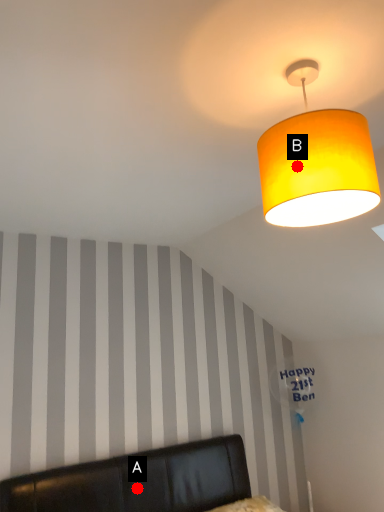
Question: Two points are circled on the image, labeled by A and B beside each circle. Among these points, which one is farthest from the camera?

Choices:
 (A) A is further
 (B) B is further

Answer: (A)